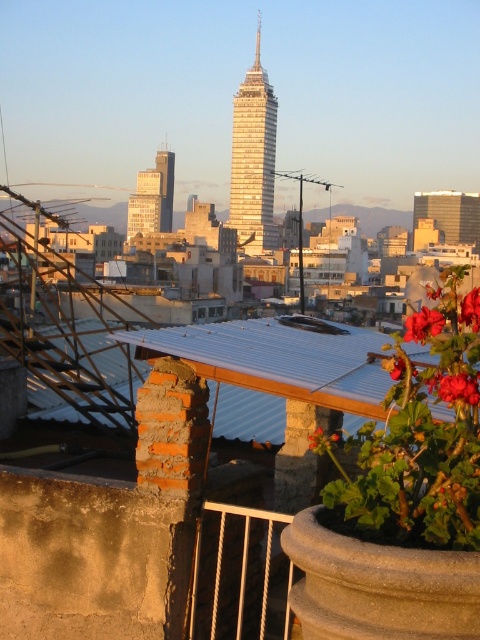
Question: Which point is closer to the camera taking this photo?

Choices:
 (A) (157, 193)
 (B) (165, 164)

Answer: (A)

Question: Which point appears farthest from the camera in this image?

Choices:
 (A) (253, 83)
 (B) (323, 433)
 (C) (421, 342)
 (D) (171, 154)

Answer: (D)

Question: Does vivid red petals at center right have a larger size compared to red matte flower at center right?

Choices:
 (A) yes
 (B) no

Answer: (B)

Question: Which object is closer to the camera taking this photo?

Choices:
 (A) vivid red petals at center right
 (B) matte glass building at center

Answer: (A)

Question: Does shiny silver tower at center appear on the left side of matte glass building at center?

Choices:
 (A) no
 (B) yes

Answer: (A)

Question: Can you confirm if red matte flower at upper right is thinner than red matte flower at center right?

Choices:
 (A) yes
 (B) no

Answer: (B)